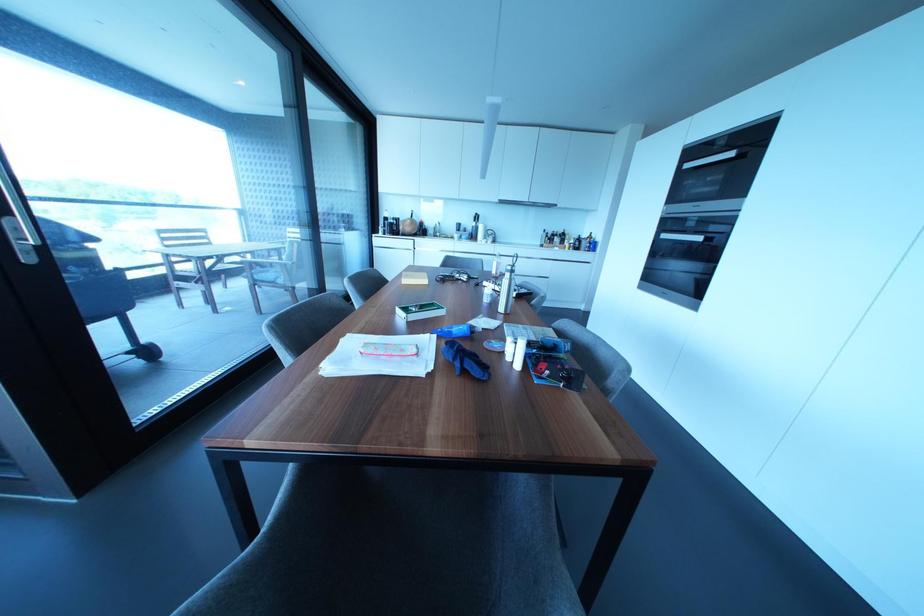
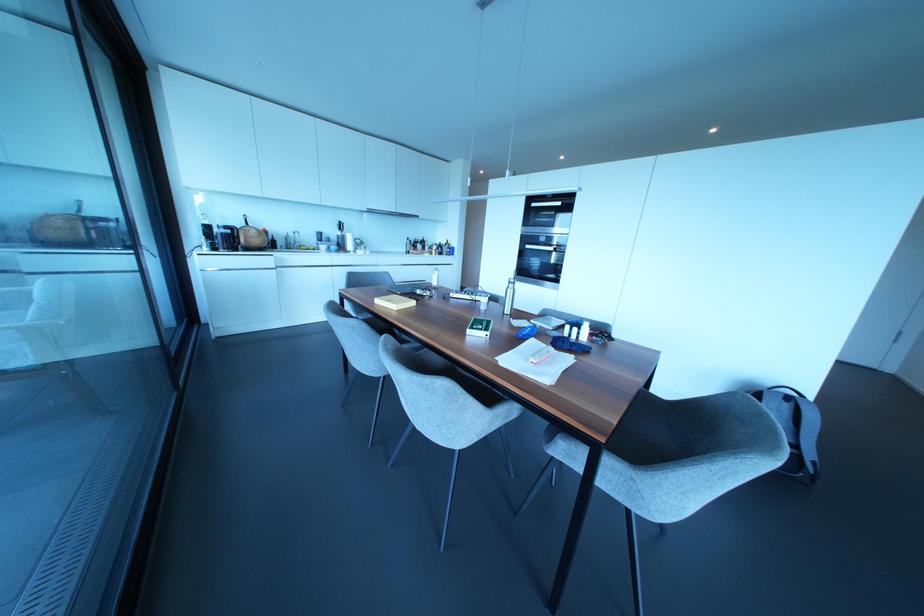
Find the pixel in the second image that matches [492,272] in the first image.

(434, 283)